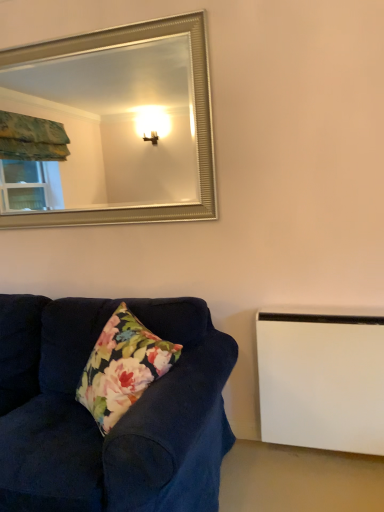
Question: Does velvet dark blue couch at lower left have a greater width compared to white matte radiator at lower right?

Choices:
 (A) yes
 (B) no

Answer: (A)

Question: Would you say velvet dark blue couch at lower left contains white matte radiator at lower right?

Choices:
 (A) no
 (B) yes

Answer: (A)

Question: From a real-world perspective, is velvet dark blue couch at lower left below white matte radiator at lower right?

Choices:
 (A) yes
 (B) no

Answer: (B)

Question: Considering the relative sizes of velvet dark blue couch at lower left and white matte radiator at lower right in the image provided, is velvet dark blue couch at lower left smaller than white matte radiator at lower right?

Choices:
 (A) yes
 (B) no

Answer: (B)

Question: Does velvet dark blue couch at lower left have a larger size compared to white matte radiator at lower right?

Choices:
 (A) no
 (B) yes

Answer: (B)

Question: Is velvet dark blue couch at lower left positioned with its back to white matte radiator at lower right?

Choices:
 (A) no
 (B) yes

Answer: (A)

Question: Can you see silver metallic mirror at upper center touching white matte radiator at lower right?

Choices:
 (A) yes
 (B) no

Answer: (B)

Question: Does silver metallic mirror at upper center have a greater height compared to white matte radiator at lower right?

Choices:
 (A) yes
 (B) no

Answer: (A)

Question: Is silver metallic mirror at upper center thinner than white matte radiator at lower right?

Choices:
 (A) no
 (B) yes

Answer: (B)

Question: Is silver metallic mirror at upper center at the left side of white matte radiator at lower right?

Choices:
 (A) no
 (B) yes

Answer: (B)

Question: Does silver metallic mirror at upper center have a smaller size compared to white matte radiator at lower right?

Choices:
 (A) no
 (B) yes

Answer: (A)

Question: From a real-world perspective, is silver metallic mirror at upper center on top of white matte radiator at lower right?

Choices:
 (A) yes
 (B) no

Answer: (A)

Question: Could you tell me if velvet dark blue couch at lower left is facing silver metallic mirror at upper center?

Choices:
 (A) no
 (B) yes

Answer: (A)